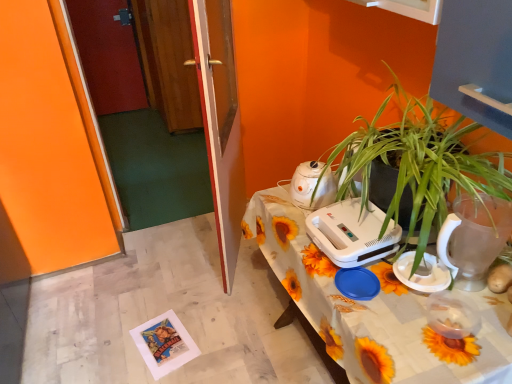
Question: Is wooden door at left, placed as the 2th glass door when sorted from back to front, in front of or behind white plastic kettle at center, which is the 1th appliance in back-to-front order, in the image?

Choices:
 (A) front
 (B) behind

Answer: (B)

Question: In terms of width, does wooden door at left, which is the second glass door from front to back, look wider or thinner when compared to white plastic kettle at center, which is the 1th appliance in back-to-front order?

Choices:
 (A) thin
 (B) wide

Answer: (A)

Question: Based on their relative distances, which object is farther from the white plastic kettle at center, the 4th appliance viewed from the front?

Choices:
 (A) white plastic appliance at upper right, which is the 3th appliance in front-to-back order
 (B) wooden door at left, the 3th glass door from the front
 (C) transparent glass door at center, which appears as the third glass door when viewed from the back
 (D) transparent plastic pitcher at right, marked as the fourth appliance in a back-to-front arrangement
 (E) white plastic plate at lower right, acting as the second appliance starting from the front

Answer: (B)

Question: Considering the real-world distances, which object is farthest from the green leafy plant at right?

Choices:
 (A) wooden door at left, which is the second glass door from front to back
 (B) white plastic plate at lower right, positioned as the 3th appliance in back-to-front order
 (C) white plastic table at center
 (D) transparent glass door at center, which is the 1th glass door from front to back
 (E) white plastic appliance at upper right, which is the 3th appliance in front-to-back order

Answer: (A)